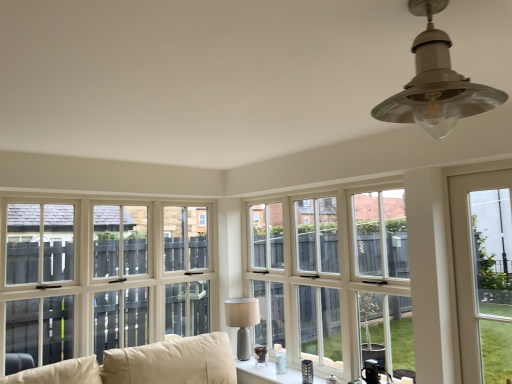
Question: Can you confirm if satin silver lampshade at upper center, the 1th lamp when ordered from right to left, is bigger than white wood window at center, acting as the 2th window starting from the left?

Choices:
 (A) yes
 (B) no

Answer: (B)

Question: From a real-world perspective, is satin silver lampshade at upper center, which is counted as the second lamp, starting from the left, below white wood window at center, acting as the 2th window starting from the left?

Choices:
 (A) no
 (B) yes

Answer: (A)

Question: Is satin silver lampshade at upper center, which is counted as the second lamp, starting from the left, outside white wood window at center, which appears as the second window when viewed from the right?

Choices:
 (A) no
 (B) yes

Answer: (B)

Question: Does satin silver lampshade at upper center, the 1th lamp viewed from the front, have a greater height compared to white wood window at center, which appears as the second window when viewed from the right?

Choices:
 (A) yes
 (B) no

Answer: (B)

Question: Is satin silver lampshade at upper center, the 1th lamp when ordered from right to left, far away from white wood window at center, which appears as the second window when viewed from the right?

Choices:
 (A) no
 (B) yes

Answer: (B)

Question: Do you think matte gray lamp at center, which is the second lamp from top to bottom, is within beige fabric couch at lower left, or outside of it?

Choices:
 (A) outside
 (B) inside

Answer: (A)

Question: Visually, is matte gray lamp at center, which is the second lamp from top to bottom, positioned to the left or to the right of beige fabric couch at lower left?

Choices:
 (A) left
 (B) right

Answer: (B)

Question: Based on their sizes in the image, would you say matte gray lamp at center, which is the second lamp from top to bottom, is bigger or smaller than beige fabric couch at lower left?

Choices:
 (A) big
 (B) small

Answer: (B)

Question: In terms of height, does matte gray lamp at center, which ranks as the second lamp in front-to-back order, look taller or shorter compared to beige fabric couch at lower left?

Choices:
 (A) short
 (B) tall

Answer: (B)

Question: Does point (346, 198) appear closer or farther from the camera than point (243, 370)?

Choices:
 (A) closer
 (B) farther

Answer: (A)

Question: In the image, is white wood window at center, which appears as the second window when viewed from the right, positioned in front of or behind white glossy windowsill at center, placed as the first window when sorted from left to right?

Choices:
 (A) behind
 (B) front

Answer: (B)

Question: Considering the relative positions of white wood window at center, acting as the 2th window starting from the left, and white glossy windowsill at center, marked as the third window in a right-to-left arrangement, in the image provided, is white wood window at center, acting as the 2th window starting from the left, to the left or to the right of white glossy windowsill at center, marked as the third window in a right-to-left arrangement,?

Choices:
 (A) right
 (B) left

Answer: (A)

Question: From their relative heights in the image, would you say white wood window at center, which appears as the second window when viewed from the right, is taller or shorter than white glossy windowsill at center, placed as the first window when sorted from left to right?

Choices:
 (A) short
 (B) tall

Answer: (B)

Question: In terms of height, does clear glass door at right, arranged as the 3th window when viewed from the left, look taller or shorter compared to satin silver lampshade at upper center, the 1th lamp viewed from the front?

Choices:
 (A) short
 (B) tall

Answer: (B)

Question: Considering the positions of clear glass door at right, the 1th window viewed from the right, and satin silver lampshade at upper center, the 1th lamp when ordered from right to left, in the image, is clear glass door at right, the 1th window viewed from the right, wider or thinner than satin silver lampshade at upper center, the 1th lamp when ordered from right to left,?

Choices:
 (A) wide
 (B) thin

Answer: (B)